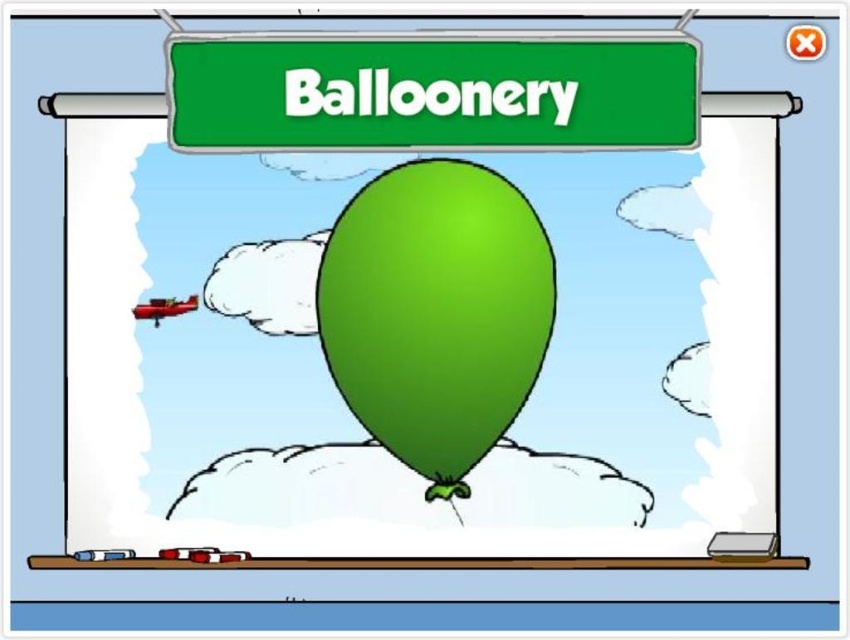
Question: Among these points, which one is farthest from the camera?

Choices:
 (A) (353, 68)
 (B) (355, 200)

Answer: (B)

Question: Does green matte signboard at upper center have a larger size compared to green rubber balloon at center?

Choices:
 (A) yes
 (B) no

Answer: (B)

Question: Which point is farther from the camera taking this photo?

Choices:
 (A) (403, 273)
 (B) (663, 86)

Answer: (A)

Question: Does green matte signboard at upper center have a smaller size compared to green rubber balloon at center?

Choices:
 (A) no
 (B) yes

Answer: (B)

Question: Does green matte signboard at upper center have a larger size compared to green rubber balloon at center?

Choices:
 (A) yes
 (B) no

Answer: (B)